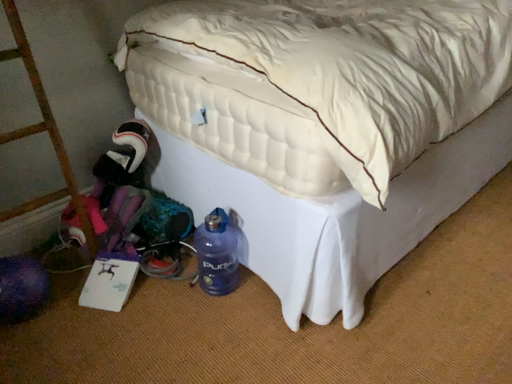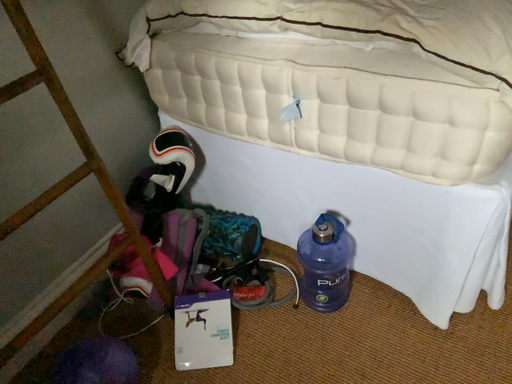
Question: Which way did the camera rotate in the video?

Choices:
 (A) rotated right
 (B) rotated left

Answer: (A)